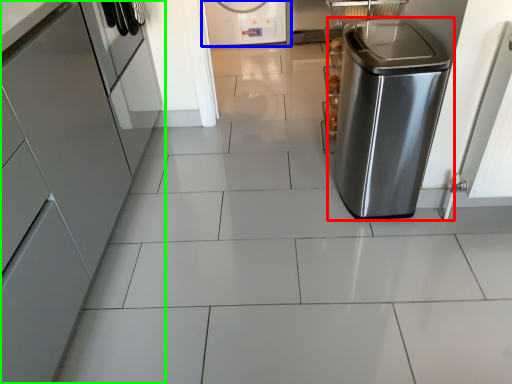
Question: Which is nearer to the home appliance (highlighted by a red box)? home appliance (highlighted by a blue box) or home appliance (highlighted by a green box).

Choices:
 (A) home appliance
 (B) home appliance

Answer: (B)